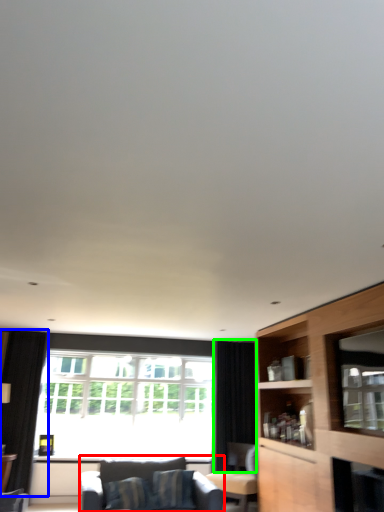
Question: Estimate the real-world distances between objects in this image. Which object is closer to studio couch (highlighted by a red box), curtain (highlighted by a blue box) or curtain (highlighted by a green box)?

Choices:
 (A) curtain
 (B) curtain

Answer: (B)